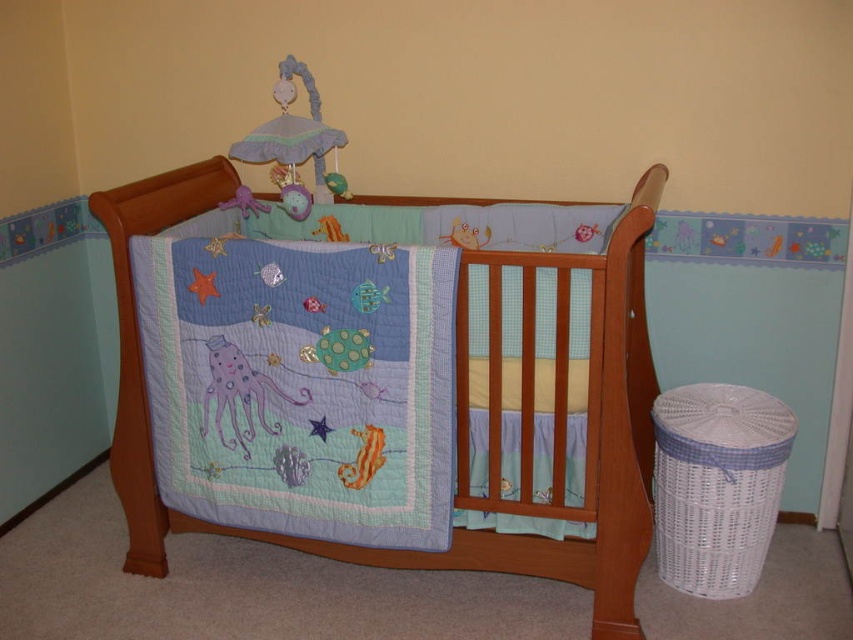
In the scene shown: You are a parent entering the nursery and see the matte blue quilted crib at center and the purple fabric octopus at center. Which object is located to the right of the other?

The matte blue quilted crib at center is positioned on the right side of purple fabric octopus at center, so the crib is to the right of the octopus.